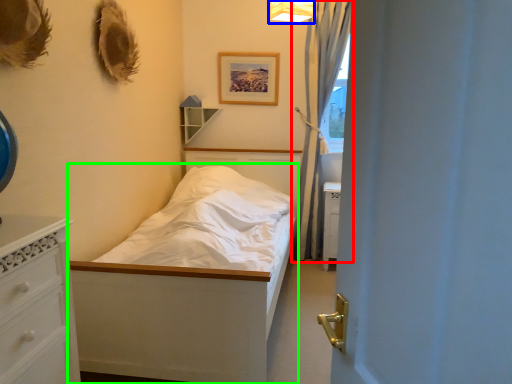
Question: Estimate the real-world distances between objects in this image. Which object is farther from curtain (highlighted by a red box), light fixture (highlighted by a blue box) or bed (highlighted by a green box)?

Choices:
 (A) light fixture
 (B) bed

Answer: (B)